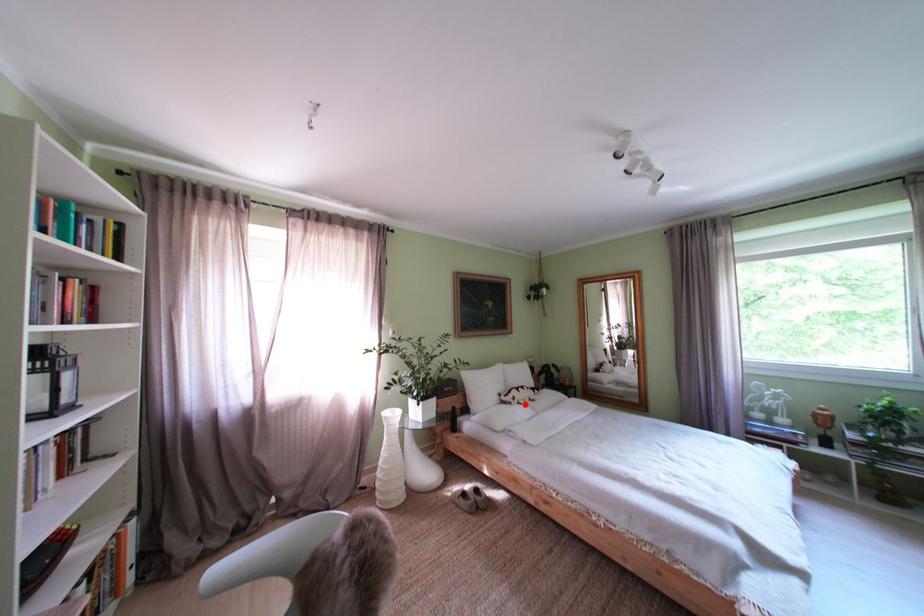
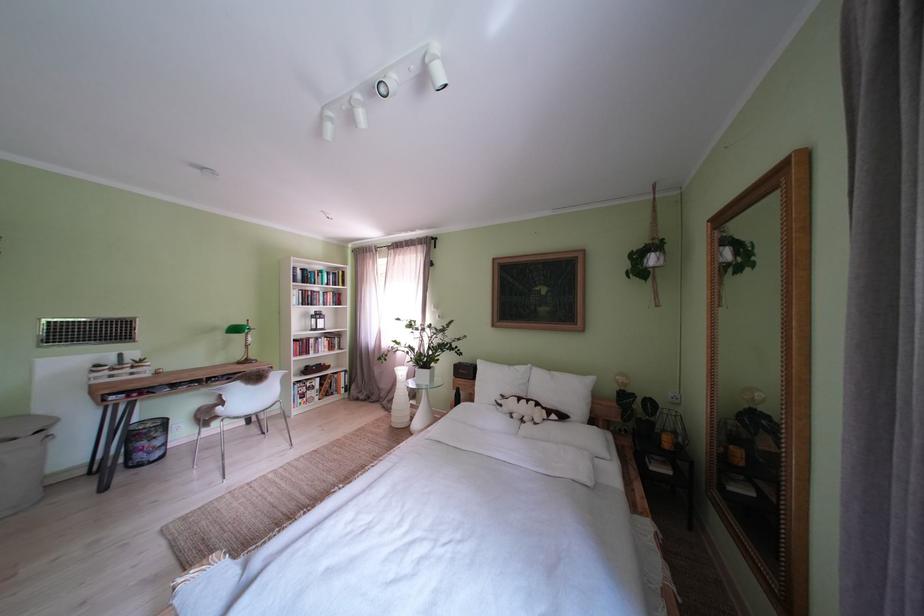
Where in the second image is the point corresponding to the highlighted location from the first image?

(512, 411)